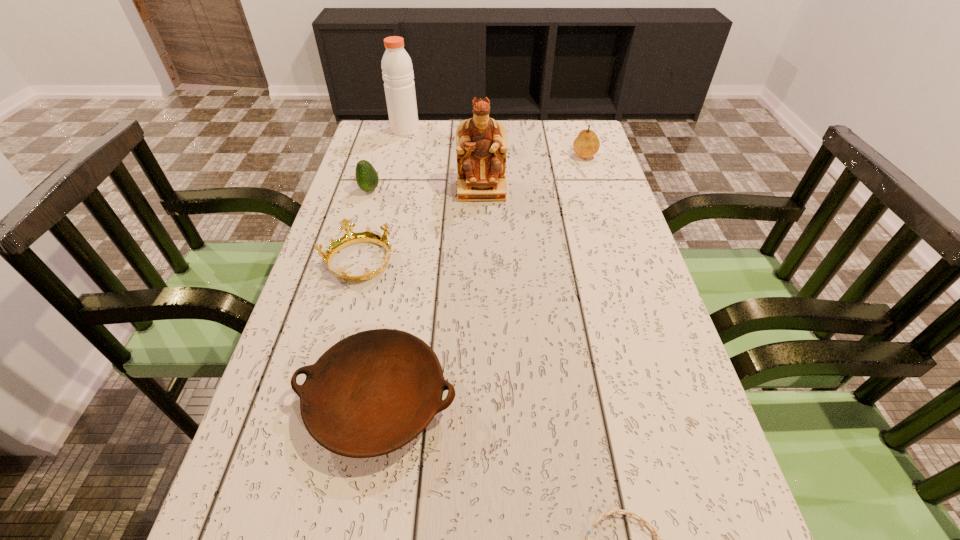
Where is `vacant space situated 0.110m on the right of the avocado`? The width and height of the screenshot is (960, 540). vacant space situated 0.110m on the right of the avocado is located at coordinates (419, 190).

At what (x,y) coordinates should I click in order to perform the action: click on free spot located on the back of the fifth farthest object. Please return your answer as a coordinate pair (x, y). The height and width of the screenshot is (540, 960). Looking at the image, I should click on (380, 185).

Image resolution: width=960 pixels, height=540 pixels. In order to click on free space located 0.050m on the left of the sixth farthest object in this screenshot , I will do `click(271, 400)`.

What are the coordinates of `shaker situated at the far edge` in the screenshot? It's located at (397, 69).

In order to click on pear that is at the far edge in this screenshot , I will do `click(586, 145)`.

The height and width of the screenshot is (540, 960). In order to click on shaker that is at the left edge in this screenshot , I will do `click(397, 69)`.

Find the location of a particular element. This screenshot has width=960, height=540. avocado that is at the left edge is located at coordinates (366, 176).

Identify the location of crown that is at the left edge. coord(349,238).

At what (x,y) coordinates should I click in order to perform the action: click on plate at the left edge. Please return your answer as a coordinate pair (x, y). The image size is (960, 540). Looking at the image, I should click on (373, 392).

Identify the location of object located in the right edge section of the desktop. (586, 145).